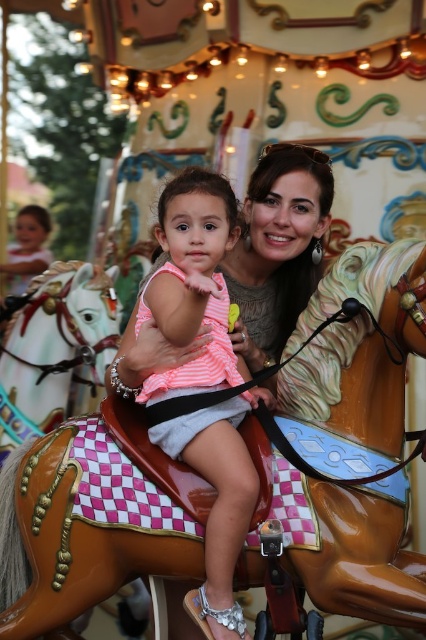
You are taking a photo of the carousel scene. You notice two points in the image labeled as point [201,604] and point [57,266]. Which point is closer to the camera?

Point [201,604] is closer to the camera than point [57,266].

You are a photographer taking a picture of the shiny brown horse at center and the pink striped fabric at center. Which object should you focus on first if you want to capture both in the same frame without moving the camera?

The shiny brown horse at center is larger than the pink striped fabric at center, so focusing on the shiny brown horse at center first would ensure it fills the frame appropriately while still capturing the smaller pink striped fabric at center in the same shot.